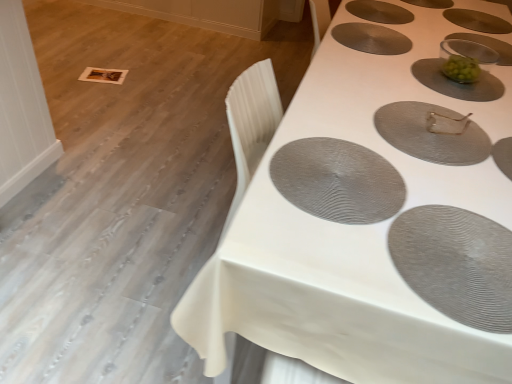
This screenshot has width=512, height=384. Identify the location of free space behind gray textured placemat at lower right, the first oval from the front. (457, 183).